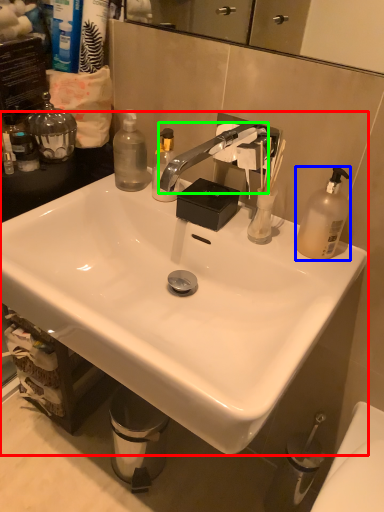
Question: Based on their relative distances, which object is nearer to sink (highlighted by a red box)? Choose from bottle (highlighted by a blue box) and faucet (highlighted by a green box).

Choices:
 (A) bottle
 (B) faucet

Answer: (B)